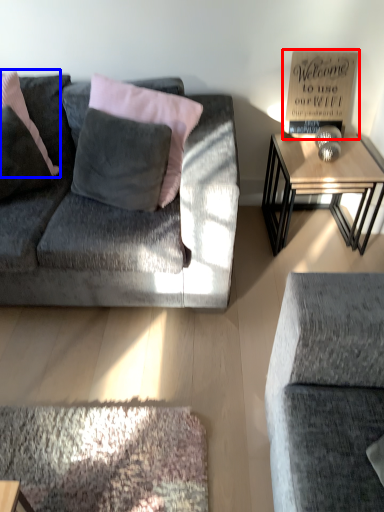
Question: Among these objects, which one is farthest to the camera, bulletin board (highlighted by a red box) or pillow (highlighted by a blue box)?

Choices:
 (A) bulletin board
 (B) pillow

Answer: (A)